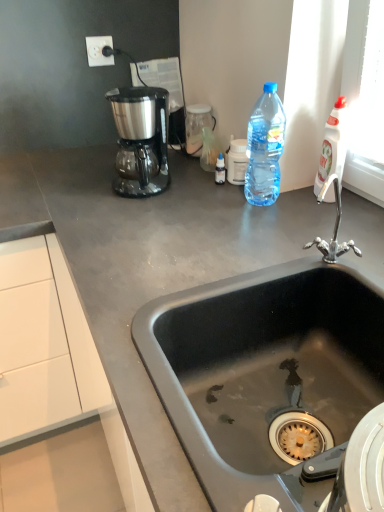
In order to click on vacant space situated above gray matte countertop at center (from a real-world perspective) in this screenshot , I will do `click(80, 178)`.